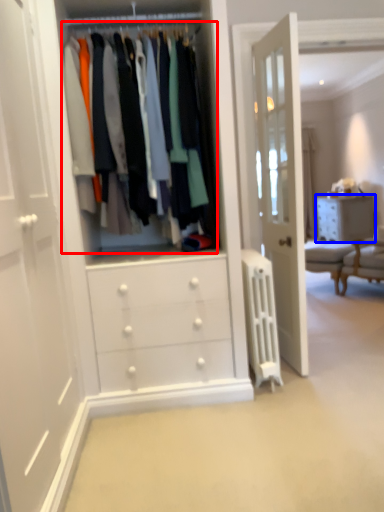
Question: Which of the following is the closest to the observer, closet (highlighted by a red box) or chest of drawers (highlighted by a blue box)?

Choices:
 (A) closet
 (B) chest of drawers

Answer: (A)